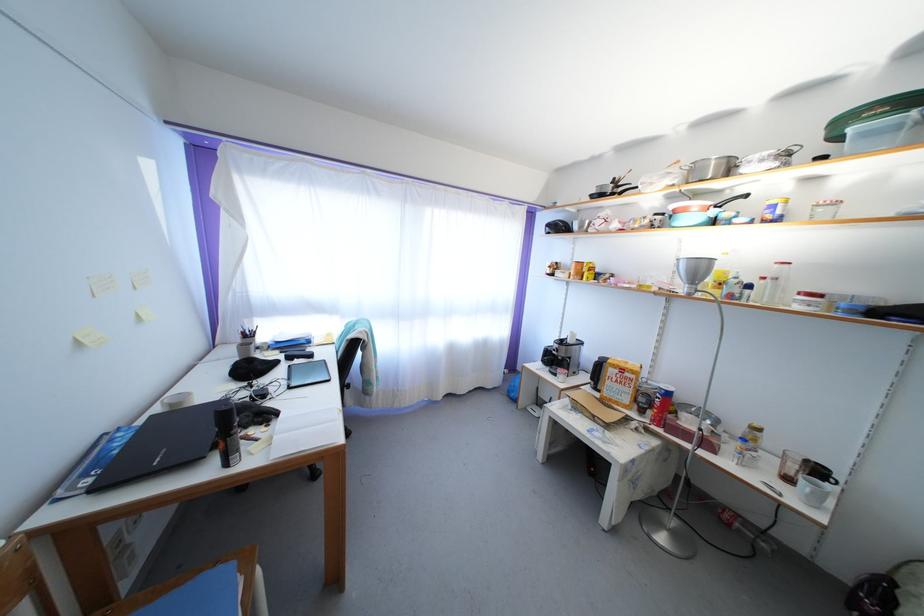
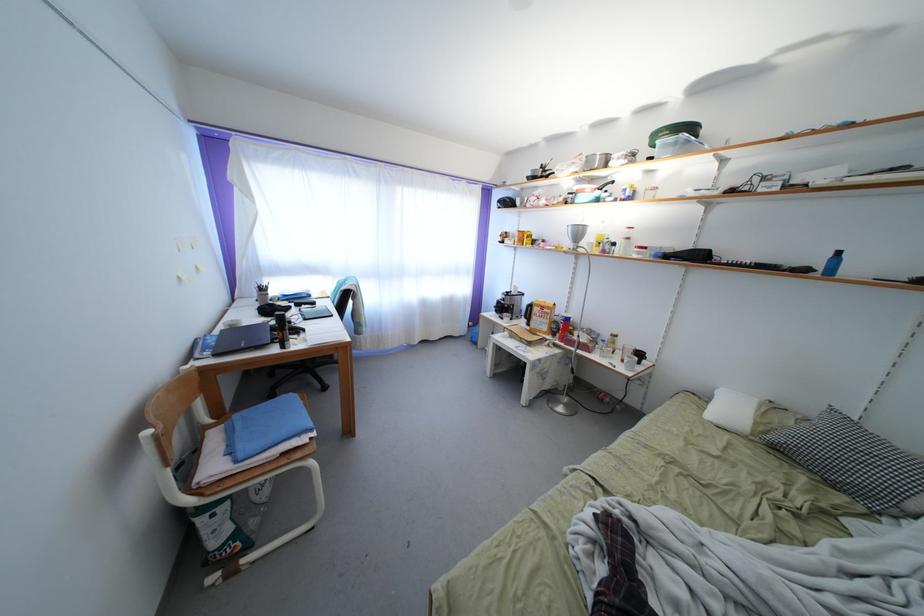
The point at (628, 371) is marked in the first image. Where is the corresponding point in the second image?

(549, 310)